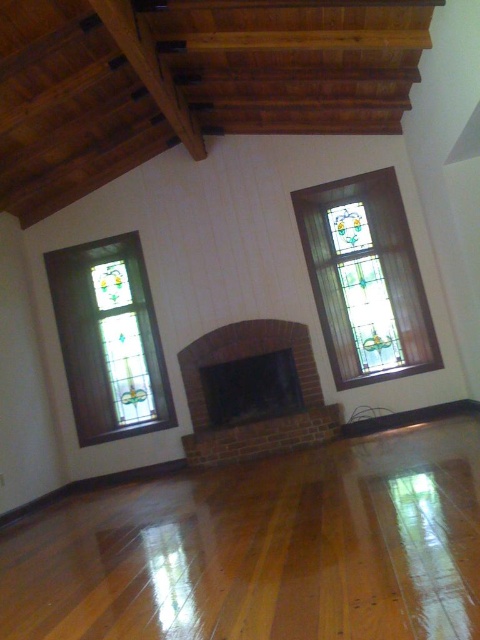
Question: Which object is positioned closest to the stained glass window at left?

Choices:
 (A) stained glass window at center
 (B) brick fireplace at center

Answer: (B)

Question: Can you confirm if stained glass window at left is positioned to the left of brick fireplace at center?

Choices:
 (A) yes
 (B) no

Answer: (A)

Question: Does stained glass window at center appear over stained glass window at left?

Choices:
 (A) yes
 (B) no

Answer: (A)

Question: In this image, where is stained glass window at left located relative to brick fireplace at center?

Choices:
 (A) above
 (B) below

Answer: (A)

Question: Which object is closer to the camera taking this photo?

Choices:
 (A) brick fireplace at center
 (B) stained glass window at center

Answer: (A)

Question: Among these objects, which one is nearest to the camera?

Choices:
 (A) stained glass window at center
 (B) stained glass window at left

Answer: (A)